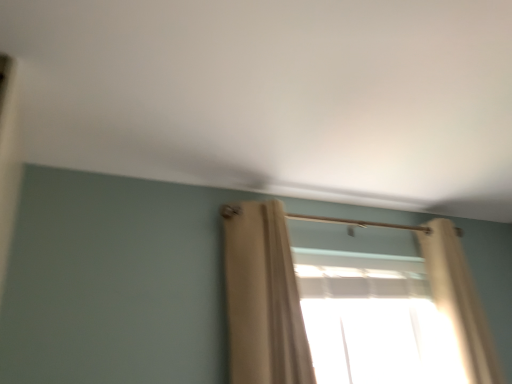
Question: Considering their positions, is translucent fabric at center located in front of or behind beige fabric curtain at center, which is the first curtain in left-to-right order?

Choices:
 (A) front
 (B) behind

Answer: (B)

Question: Considering the positions of point (428, 329) and point (247, 211), is point (428, 329) closer or farther from the camera than point (247, 211)?

Choices:
 (A) closer
 (B) farther

Answer: (B)

Question: Estimate the real-world distances between objects in this image. Which object is closer to the beige fabric curtain at center, placed as the second curtain when sorted from right to left?

Choices:
 (A) translucent fabric at center
 (B) beige sheer curtain at right, the 1th curtain in the right-to-left sequence

Answer: (A)

Question: Which object is positioned farthest from the beige fabric curtain at center, which is the first curtain in left-to-right order?

Choices:
 (A) beige sheer curtain at right, the second curtain when ordered from left to right
 (B) translucent fabric at center

Answer: (A)